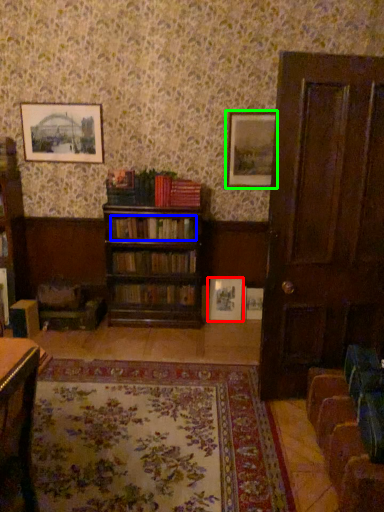
Question: Estimate the real-world distances between objects in this image. Which object is farther from picture frame (highlighted by a red box), book (highlighted by a blue box) or picture frame (highlighted by a green box)?

Choices:
 (A) book
 (B) picture frame

Answer: (B)